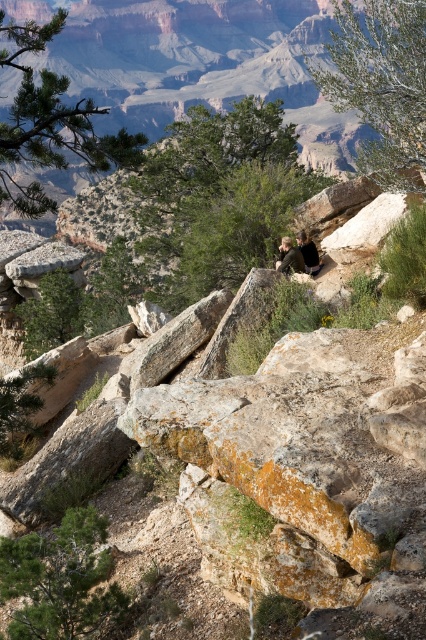
Question: Is green fabric jacket at center bigger than dark brown leather jacket at center?

Choices:
 (A) yes
 (B) no

Answer: (A)

Question: Which object appears farthest from the camera in this image?

Choices:
 (A) green fabric jacket at center
 (B) dark brown leather jacket at center

Answer: (B)

Question: Which of the following is the farthest from the observer?

Choices:
 (A) dark brown leather jacket at center
 (B) green fabric jacket at center

Answer: (A)

Question: Considering the relative positions of green fabric jacket at center and dark brown leather jacket at center in the image provided, where is green fabric jacket at center located with respect to dark brown leather jacket at center?

Choices:
 (A) right
 (B) left

Answer: (B)

Question: Is green fabric jacket at center to the left of dark brown leather jacket at center from the viewer's perspective?

Choices:
 (A) no
 (B) yes

Answer: (B)